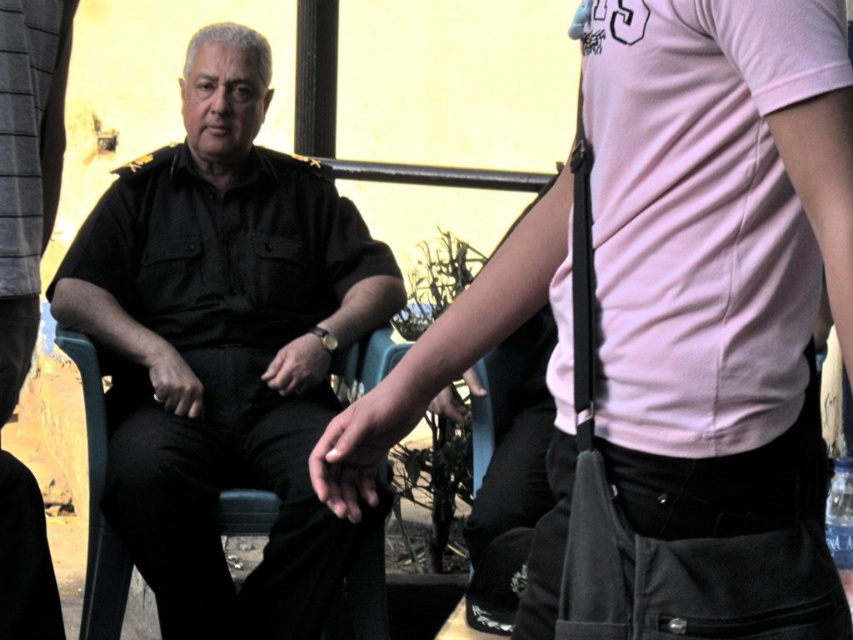
You are standing in front of the two people sitting under the shaded area. Which person is wearing the pink matte shirt at center located to the right side of the black uniform at center?

The pink matte shirt at center is to the right of the black uniform at center, so the person wearing the pink matte shirt at center is located to the right side of the black uniform at center.

You are planning to take a photo of the two people in the scene. The pink matte shirt at center and the black uniform at center are both in the frame. To ensure both are fully visible, which one should you adjust the camera angle to focus on first?

The pink matte shirt at center is positioned under the black uniform at center, so you should adjust the camera angle to focus on the black uniform at center first to avoid blocking the pink matte shirt at center.